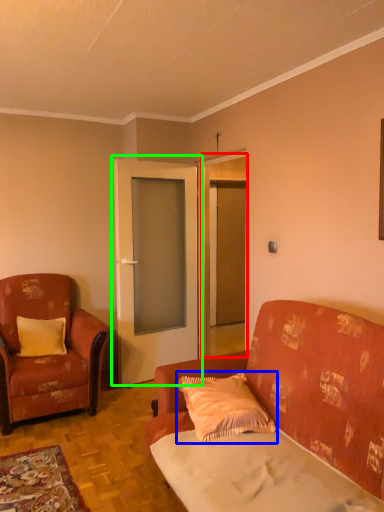
Question: Which object is the closest to the door (highlighted by a red box)? Choose among these: pillow (highlighted by a blue box) or door (highlighted by a green box).

Choices:
 (A) pillow
 (B) door

Answer: (B)